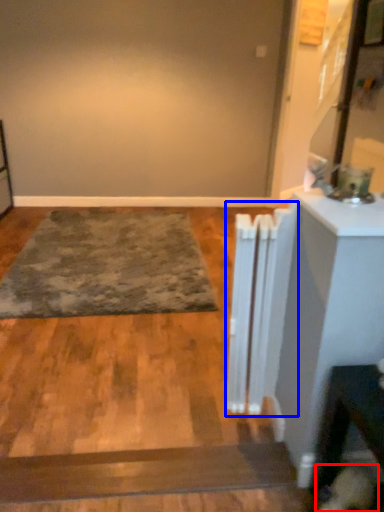
Question: Which point is closer to the camera, dog (highlighted by a red box) or radiator (highlighted by a blue box)?

Choices:
 (A) dog
 (B) radiator

Answer: (A)